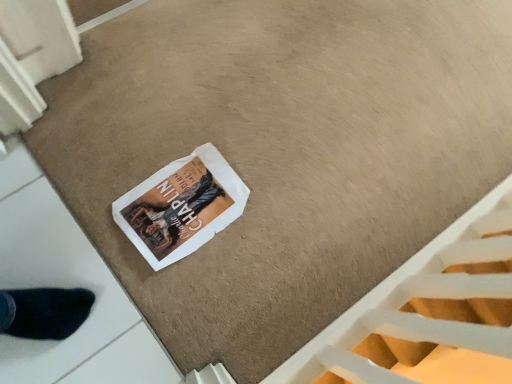
At what (x,y) coordinates should I click in order to perform the action: click on vacant space to the right of white paper magazine at center. Please return your answer as a coordinate pair (x, y). This screenshot has width=512, height=384. Looking at the image, I should click on (256, 272).